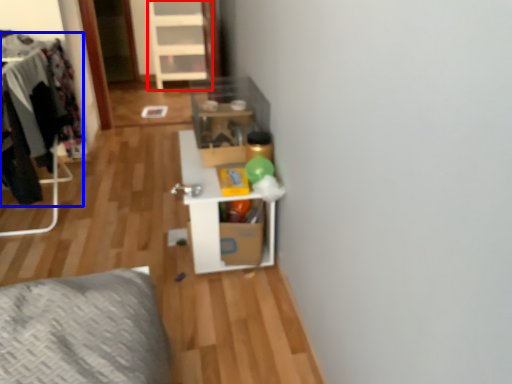
Question: Which of the following is the closest to the observer, dresser (highlighted by a red box) or clothing (highlighted by a blue box)?

Choices:
 (A) dresser
 (B) clothing

Answer: (B)